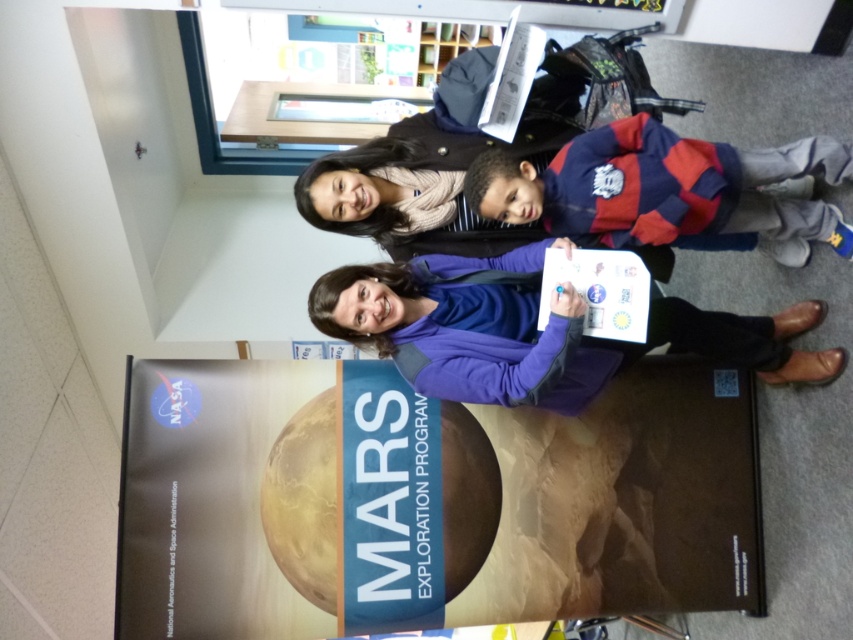
You are a photographer at the NASA Mars Exploration Program event and need to ensure that both the purple fabric jacket at center and the striped fleece jacket at center fit within the frame of your camera. Given that the camera has a limited horizontal field of view, which jacket requires more space horizontally to capture fully?

The purple fabric jacket at center requires more horizontal space because its width is larger than the striped fleece jacket at center.

You are an event organizer who needs to decide if the striped fleece jacket at center can be placed on the transparent glass table at upper center without hanging over the edges. Based on their sizes, can the jacket fit on the table?

The striped fleece jacket at center is wider than the transparent glass table at upper center, so placing the jacket on the table would cause it to hang over the edges.

You are a photographer setting up for a group photo at the NASA Mars Exploration Program event. You have a camera with a 1.2 meter wide lens. The two subjects wearing the purple fabric jacket at center and the transparent glass table at upper center are in your frame. Can the lens capture both objects in full without cropping either?

The purple fabric jacket at center is wider than the transparent glass table at upper center. Since the jacket is wider, the lens must be at least as wide as the jacket to capture both. If the jacket is wider than 1.2 meters, the lens cannot capture both fully. However, without specific measurements, we can only confirm the jacket is wider than the table. Please ensure the lens can accommodate the jacket.